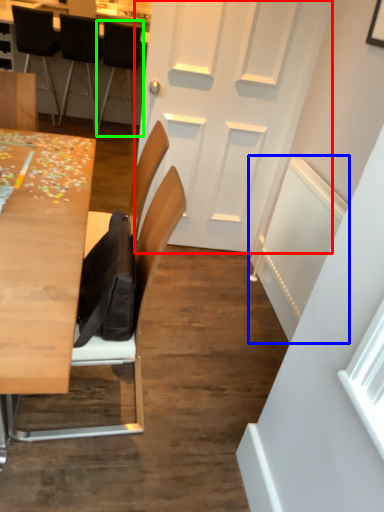
Question: Based on their relative distances, which object is farther from door (highlighted by a red box)? Choose from radiator (highlighted by a blue box) and chair (highlighted by a green box).

Choices:
 (A) radiator
 (B) chair

Answer: (B)